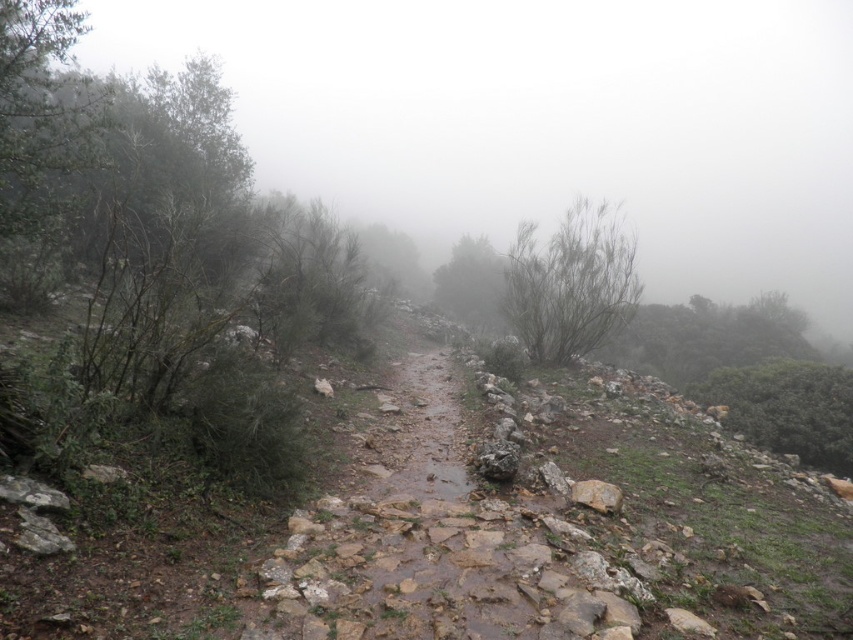
Can you confirm if green leafy bush at center is shorter than green leafy bush at upper right?

Incorrect, green leafy bush at center's height does not fall short of green leafy bush at upper right's.

Does green leafy bush at center appear on the left side of green leafy bush at upper right?

Yes, green leafy bush at center is to the left of green leafy bush at upper right.

The image size is (853, 640). I want to click on green leafy bush at center, so click(x=572, y=284).

From the picture: Does green leafy bush at right have a greater height compared to green matte bush at center?

No.

Does green leafy bush at right have a lesser width compared to green matte bush at center?

Correct, green leafy bush at right's width is less than green matte bush at center's.

Is point (787, 420) positioned before point (399, 252)?

That is True.

Locate an element on the screen. The height and width of the screenshot is (640, 853). green leafy bush at right is located at coordinates (787, 408).

Is green leafy bush at center closer to camera compared to green leafy bush at right?

No.

Can you confirm if green leafy bush at center is positioned to the left of green leafy bush at right?

Indeed, green leafy bush at center is positioned on the left side of green leafy bush at right.

This screenshot has width=853, height=640. What are the coordinates of `green leafy bush at center` in the screenshot? It's located at (572, 284).